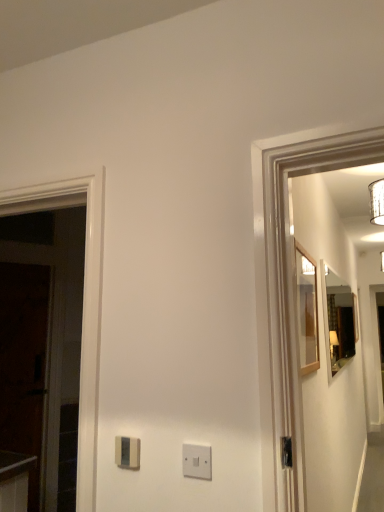
Describe the element at coordinates (127, 452) in the screenshot. I see `satin beige light switch at center, the second light switch when ordered from front to back` at that location.

Locate an element on the screen. The height and width of the screenshot is (512, 384). satin beige light switch at center, which is counted as the second light switch, starting from the right is located at coordinates (127, 452).

Find the location of `white plastic light switch at center, marked as the first light switch in a front-to-back arrangement`. white plastic light switch at center, marked as the first light switch in a front-to-back arrangement is located at coordinates (197, 461).

At what (x,y) coordinates should I click in order to perform the action: click on matte wooden mirror at right, the 1th mirror in the back-to-front sequence. Please return your answer as a coordinate pair (x, y). The width and height of the screenshot is (384, 512). Looking at the image, I should click on (338, 320).

Find the location of `mirror below the wooden-framed mirror at right, the 2th mirror from the right (from a real-world perspective)`. mirror below the wooden-framed mirror at right, the 2th mirror from the right (from a real-world perspective) is located at coordinates (338, 320).

Considering the sizes of objects wooden-framed mirror at right, which is the second mirror from back to front, and matte wooden mirror at right, the 1th mirror in the back-to-front sequence, in the image provided, who is shorter, wooden-framed mirror at right, which is the second mirror from back to front, or matte wooden mirror at right, the 1th mirror in the back-to-front sequence,?

Standing shorter between the two is wooden-framed mirror at right, which is the second mirror from back to front.

Would you consider wooden-framed mirror at right, arranged as the 1th mirror when viewed from the left, to be distant from matte wooden mirror at right, which is the first mirror in right-to-left order?

Yes, wooden-framed mirror at right, arranged as the 1th mirror when viewed from the left, is far from matte wooden mirror at right, which is the first mirror in right-to-left order.

Is point (313, 310) positioned behind point (344, 310)?

That is False.

Considering the relative positions of matte wooden mirror at right, which is the first mirror in right-to-left order, and dark wood door at left in the image provided, is matte wooden mirror at right, which is the first mirror in right-to-left order, in front of dark wood door at left?

Yes, matte wooden mirror at right, which is the first mirror in right-to-left order, is closer to the viewer.

Could you tell me if matte wooden mirror at right, the 1th mirror in the back-to-front sequence, is facing dark wood door at left?

No, matte wooden mirror at right, the 1th mirror in the back-to-front sequence, is not turned towards dark wood door at left.

Is dark wood door at left completely or partially inside matte wooden mirror at right, acting as the second mirror starting from the front?

No, dark wood door at left is not inside matte wooden mirror at right, acting as the second mirror starting from the front.

From a real-world perspective, is matte wooden mirror at right, which is the second mirror from left to right, on dark wood door at left?

Indeed, from a real-world perspective, matte wooden mirror at right, which is the second mirror from left to right, stands above dark wood door at left.

From a real-world perspective, is satin beige light switch at center, which is counted as the second light switch, starting from the right, positioned under wooden-framed mirror at right, the 2th mirror from the right, based on gravity?

Yes, from a real-world perspective, satin beige light switch at center, which is counted as the second light switch, starting from the right, is under wooden-framed mirror at right, the 2th mirror from the right.

Does satin beige light switch at center, the 1th light switch in the left-to-right sequence, have a greater width compared to wooden-framed mirror at right, arranged as the 1th mirror when viewed from the left?

In fact, satin beige light switch at center, the 1th light switch in the left-to-right sequence, might be narrower than wooden-framed mirror at right, arranged as the 1th mirror when viewed from the left.

Can you tell me how much satin beige light switch at center, the 1th light switch in the left-to-right sequence, and wooden-framed mirror at right, arranged as the 1th mirror when viewed from the left, differ in facing direction?

The angular difference between satin beige light switch at center, the 1th light switch in the left-to-right sequence, and wooden-framed mirror at right, arranged as the 1th mirror when viewed from the left, is 91.1 degrees.

From the image's perspective, is wooden-framed mirror at right, arranged as the 1th mirror when viewed from the left, on top of satin beige light switch at center, marked as the 1th light switch in a back-to-front arrangement?

Correct, wooden-framed mirror at right, arranged as the 1th mirror when viewed from the left, appears higher than satin beige light switch at center, marked as the 1th light switch in a back-to-front arrangement, in the image.

Is wooden-framed mirror at right, which is the second mirror from back to front, completely or partially outside of satin beige light switch at center, marked as the 1th light switch in a back-to-front arrangement?

Indeed, wooden-framed mirror at right, which is the second mirror from back to front, is completely outside satin beige light switch at center, marked as the 1th light switch in a back-to-front arrangement.

How many degrees apart are the facing directions of wooden-framed mirror at right, the 2th mirror from the right, and satin beige light switch at center, which is counted as the second light switch, starting from the right?

They differ by 91.1 degrees in their facing directions.

Which point is more forward, (309, 271) or (130, 445)?

The point (130, 445) is in front.

Is satin beige light switch at center, which is counted as the second light switch, starting from the right, positioned with its back to dark wood door at left?

satin beige light switch at center, which is counted as the second light switch, starting from the right, is not turned away from dark wood door at left.

Which object is closer to the camera, satin beige light switch at center, which is counted as the second light switch, starting from the right, or dark wood door at left?

Positioned in front is satin beige light switch at center, which is counted as the second light switch, starting from the right.

Which object is positioned more to the left, satin beige light switch at center, which is counted as the second light switch, starting from the right, or dark wood door at left?

dark wood door at left.

Is matte wooden mirror at right, which is the second mirror from left to right, behind wooden-framed mirror at right, the 2th mirror from the right?

Yes, matte wooden mirror at right, which is the second mirror from left to right, is further from the viewer.

Is matte wooden mirror at right, which is the first mirror in right-to-left order, far away from wooden-framed mirror at right, the first mirror in the front-to-back sequence?

Yes.

Is matte wooden mirror at right, acting as the second mirror starting from the front, aimed at wooden-framed mirror at right, arranged as the 1th mirror when viewed from the left?

No, matte wooden mirror at right, acting as the second mirror starting from the front, does not turn towards wooden-framed mirror at right, arranged as the 1th mirror when viewed from the left.

From the picture: Are wooden-framed mirror at right, the 2th mirror from the right, and dark wood door at left making contact?

There is a gap between wooden-framed mirror at right, the 2th mirror from the right, and dark wood door at left.

From the image's perspective, between wooden-framed mirror at right, arranged as the 1th mirror when viewed from the left, and dark wood door at left, who is located below?

dark wood door at left, from the image's perspective.

Which of these two, wooden-framed mirror at right, the first mirror in the front-to-back sequence, or dark wood door at left, is wider?

dark wood door at left.

The height and width of the screenshot is (512, 384). Identify the location of mirror lying above the matte wooden mirror at right, the 1th mirror in the back-to-front sequence (from the image's perspective). (306, 310).

At what (x,y) coordinates should I click in order to perform the action: click on mirror that is the 1st one above the dark wood door at left (from a real-world perspective). Please return your answer as a coordinate pair (x, y). The height and width of the screenshot is (512, 384). Looking at the image, I should click on (338, 320).

Which object lies nearer to the anchor point white plastic light switch at center, marked as the first light switch in a front-to-back arrangement, dark wood door at left or satin beige light switch at center, which is counted as the second light switch, starting from the right?

Based on the image, satin beige light switch at center, which is counted as the second light switch, starting from the right, appears to be nearer to white plastic light switch at center, marked as the first light switch in a front-to-back arrangement.

Which object lies nearer to the anchor point satin beige light switch at center, marked as the 1th light switch in a back-to-front arrangement, matte wooden mirror at right, the 1th mirror in the back-to-front sequence, or dark wood door at left?

Based on the image, dark wood door at left appears to be nearer to satin beige light switch at center, marked as the 1th light switch in a back-to-front arrangement.

In the scene shown: Considering their positions, is wooden-framed mirror at right, the 2th mirror from the right, positioned further to matte wooden mirror at right, the 1th mirror in the back-to-front sequence, than dark wood door at left?

Among the two, dark wood door at left is located further to matte wooden mirror at right, the 1th mirror in the back-to-front sequence.

Looking at the image, which one is located further to dark wood door at left, satin beige light switch at center, which is counted as the second light switch, starting from the right, or matte wooden mirror at right, acting as the second mirror starting from the front?

Among the two, matte wooden mirror at right, acting as the second mirror starting from the front, is located further to dark wood door at left.

Based on their spatial positions, is white plastic light switch at center, the 2th light switch from the back, or wooden-framed mirror at right, the 2th mirror from the right, further from matte wooden mirror at right, which is the first mirror in right-to-left order?

white plastic light switch at center, the 2th light switch from the back, lies further to matte wooden mirror at right, which is the first mirror in right-to-left order, than the other object.

Considering their positions, is satin beige light switch at center, the 1th light switch in the left-to-right sequence, positioned further to matte wooden mirror at right, acting as the second mirror starting from the front, than white plastic light switch at center, which is the 1th light switch from right to left?

satin beige light switch at center, the 1th light switch in the left-to-right sequence, is positioned further to the anchor matte wooden mirror at right, acting as the second mirror starting from the front.

When comparing their distances from white plastic light switch at center, the 2th light switch from the back, does satin beige light switch at center, marked as the 1th light switch in a back-to-front arrangement, or dark wood door at left seem further?

Based on the image, dark wood door at left appears to be further to white plastic light switch at center, the 2th light switch from the back.

Considering their positions, is wooden-framed mirror at right, the first mirror in the front-to-back sequence, positioned further to satin beige light switch at center, marked as the 1th light switch in a back-to-front arrangement, than dark wood door at left?

The object further to satin beige light switch at center, marked as the 1th light switch in a back-to-front arrangement, is dark wood door at left.

Where is `light switch situated between satin beige light switch at center, the 1th light switch in the left-to-right sequence, and wooden-framed mirror at right, the 2th mirror from the right, from left to right`? The image size is (384, 512). light switch situated between satin beige light switch at center, the 1th light switch in the left-to-right sequence, and wooden-framed mirror at right, the 2th mirror from the right, from left to right is located at coordinates (197, 461).

The image size is (384, 512). What are the coordinates of `mirror between dark wood door at left and matte wooden mirror at right, which is the second mirror from left to right` in the screenshot? It's located at (306, 310).

Locate an element on the screen. mirror located between white plastic light switch at center, the 2th light switch from the back, and matte wooden mirror at right, the 1th mirror in the back-to-front sequence, in the depth direction is located at coordinates (306, 310).

Find the location of a particular element. The height and width of the screenshot is (512, 384). light switch between white plastic light switch at center, marked as the first light switch in a front-to-back arrangement, and dark wood door at left, along the z-axis is located at coordinates (127, 452).